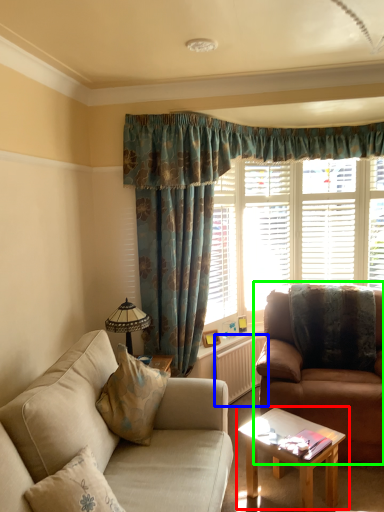
Question: Considering the real-world distances, which object is farthest from coffee table (highlighted by a red box)? radiator (highlighted by a blue box) or studio couch (highlighted by a green box)?

Choices:
 (A) radiator
 (B) studio couch

Answer: (A)